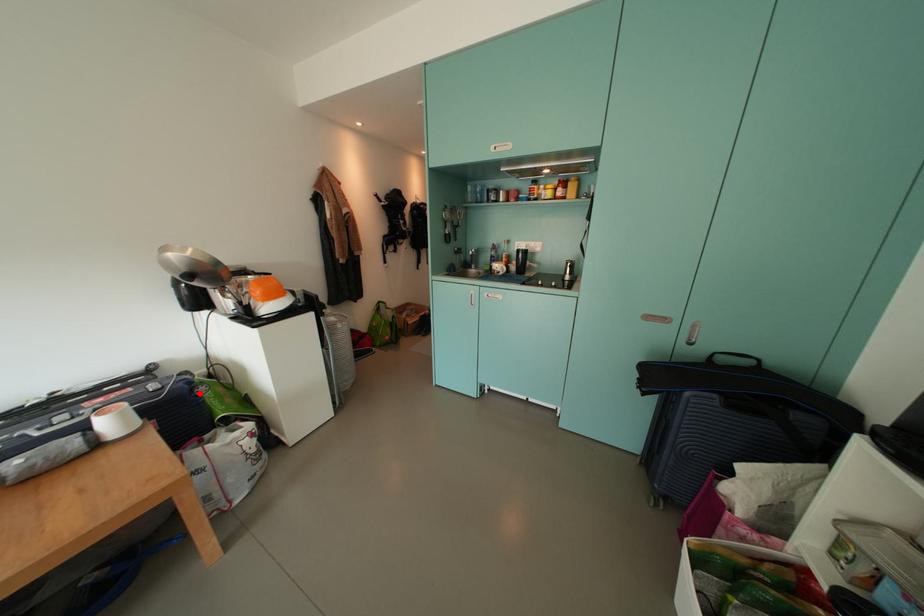
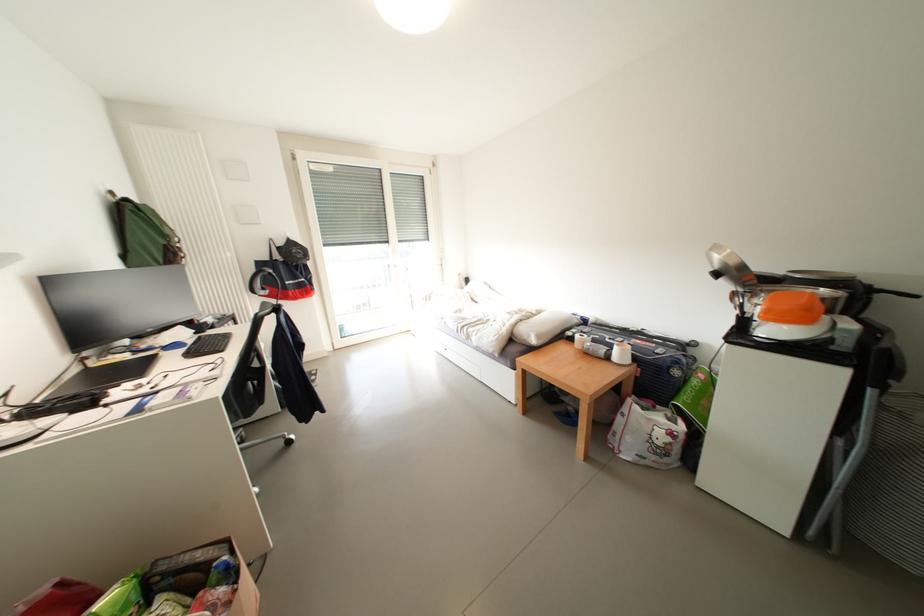
The point at the highlighted location is marked in the first image. Where is the corresponding point in the second image?

(677, 371)